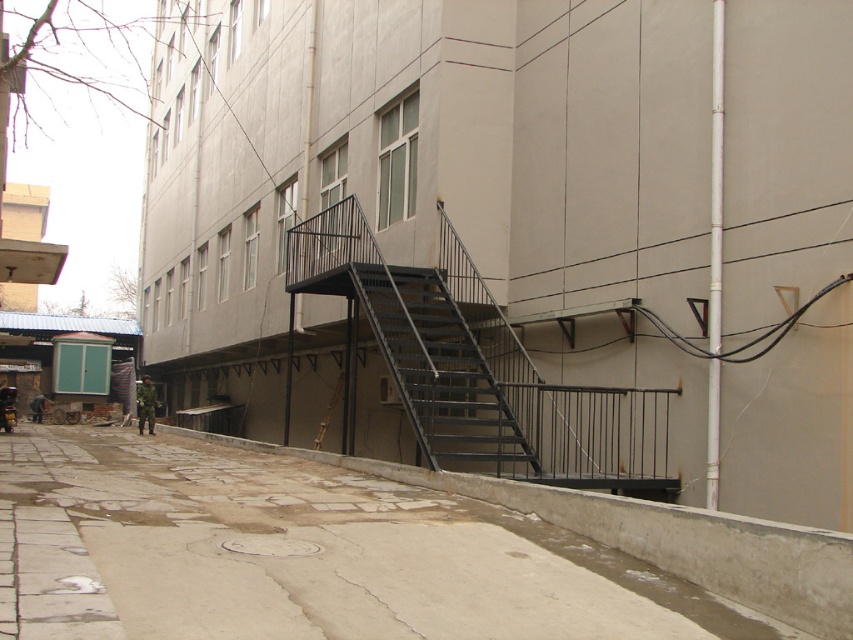
You are standing at a distance from a building and notice a specific point marked at coordinates point (x=113, y=428). If you want to estimate how far this point is from you, can you determine the distance based on the scene?

→ The distance of point (x=113, y=428) from viewer is 37.50 meters.

You are standing at the entrance of the building and want to walk to the gray concrete alley at lower center. According to the coordinates provided, in which direction should you move relative to your current position?

The gray concrete alley at lower center is located at point coordinates, so you should move towards the lower center direction from your current position at the entrance.

In the scene shown: You are standing at the entrance of the building and want to walk to the gray concrete alley at lower center. Which direction should you go relative to the black metal stairwell at center?

The gray concrete alley at lower center is located below the black metal stairwell at center, so you should go downward or behind the stairwell to reach it.